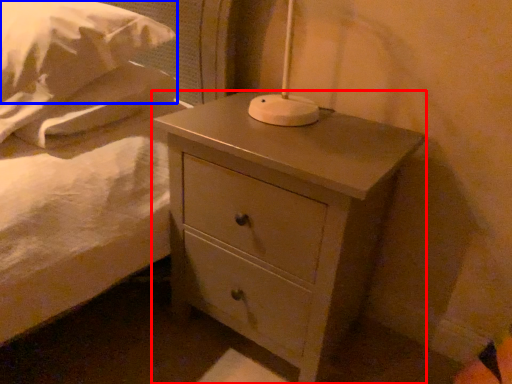
Question: Which of the following is the farthest to the observer, nightstand (highlighted by a red box) or pillow (highlighted by a blue box)?

Choices:
 (A) nightstand
 (B) pillow

Answer: (A)